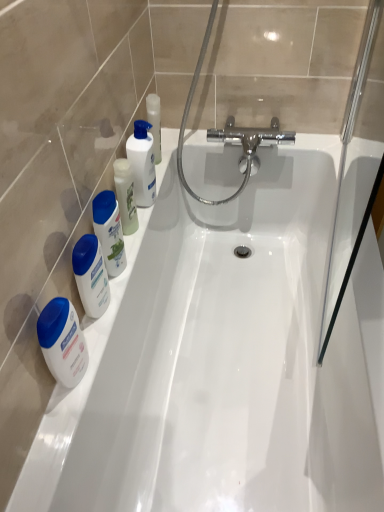
Question: In the image, is white glossy lotion at left, which is the 2th cleaning product in top-to-bottom order, on the left side or the right side of white glossy mouthwash at left, acting as the 2th mouthwash starting from the top?

Choices:
 (A) right
 (B) left

Answer: (B)

Question: Is white glossy lotion at left, which ranks as the 1th cleaning product in bottom-to-top order, bigger or smaller than white glossy mouthwash at left, acting as the 2th mouthwash starting from the top?

Choices:
 (A) small
 (B) big

Answer: (A)

Question: Estimate the real-world distances between objects in this image. Which object is closer to the white glossy mouthwash at left, which is the second mouthwash from bottom to top?

Choices:
 (A) white glossy mouthwash at left, placed as the 1th mouthwash when sorted from top to bottom
 (B) white glossy bottle at upper left, the 2th cleaning product when ordered from left to right
 (C) white glossy lotion at left, which is the first cleaning product from front to back
 (D) white glossy lotion at left, the 1th mouthwash positioned from the bottom

Answer: (C)

Question: Which is nearer to the white glossy lotion at left, acting as the first cleaning product starting from the left?

Choices:
 (A) white glossy mouthwash at left, placed as the 1th mouthwash when sorted from top to bottom
 (B) white glossy lotion at left, the 3th mouthwash viewed from the top
 (C) white glossy mouthwash at left, which is the second mouthwash from bottom to top
 (D) white glossy bottle at upper left, placed as the first cleaning product when sorted from top to bottom

Answer: (C)